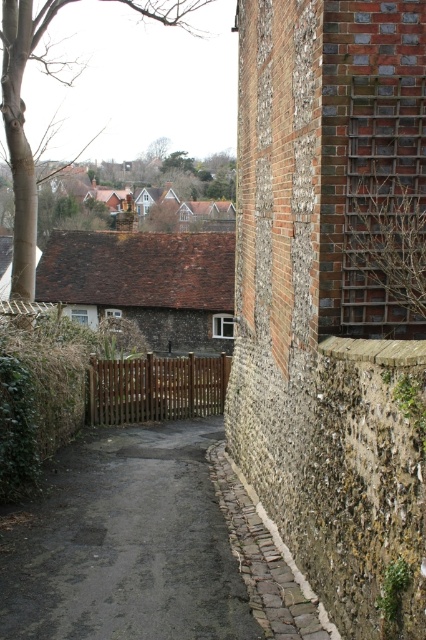
Question: Is bare branches at upper left below brown cobblestone path at lower center?

Choices:
 (A) yes
 (B) no

Answer: (B)

Question: Which point is closer to the camera?

Choices:
 (A) (244, 566)
 (B) (163, 10)

Answer: (A)

Question: Is brown cobblestone path at lower center thinner than brown wooden gate at center?

Choices:
 (A) no
 (B) yes

Answer: (B)

Question: Does bare branches at upper left appear over brown wooden gate at center?

Choices:
 (A) no
 (B) yes

Answer: (B)

Question: Which point is farther from the camera taking this photo?

Choices:
 (A) [215, 371]
 (B) [290, 561]

Answer: (A)

Question: Which of the following is the closest to the observer?

Choices:
 (A) bare branches at upper left
 (B) brown wooden gate at center

Answer: (A)